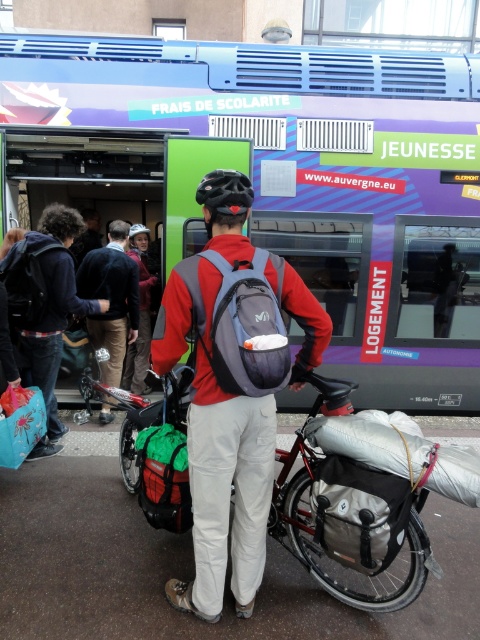
Measure the distance between gray fabric bag at center and camera.

7.33 feet

Is gray fabric bag at center thinner than matte blue fabric bag at lower left?

No.

Locate an element on the screen. The width and height of the screenshot is (480, 640). gray fabric bag at center is located at coordinates (360, 513).

Which is more to the left, matte gray backpack at center or dark blue backpack at left?

From the viewer's perspective, dark blue backpack at left appears more on the left side.

Is matte gray backpack at center behind dark blue backpack at left?

No.

At what (x,y) coordinates should I click in order to perform the action: click on matte gray backpack at center. Please return your answer as a coordinate pair (x, y). Looking at the image, I should click on (232, 397).

Who is shorter, gray fabric bag at center or green fabric bag at center?

With less height is gray fabric bag at center.

Which is below, gray fabric bag at center or green fabric bag at center?

gray fabric bag at center is lower down.

Who is more distant from viewer, (315,502) or (160,490)?

Positioned behind is point (160,490).

You are a GUI agent. You are given a task and a screenshot of the screen. Output one action in this format:
    pyautogui.click(x=<x>, y=<y>)
    Task: Click on the gray fabric bag at center
    This screenshot has width=480, height=640.
    Given the screenshot: What is the action you would take?
    pyautogui.click(x=360, y=513)